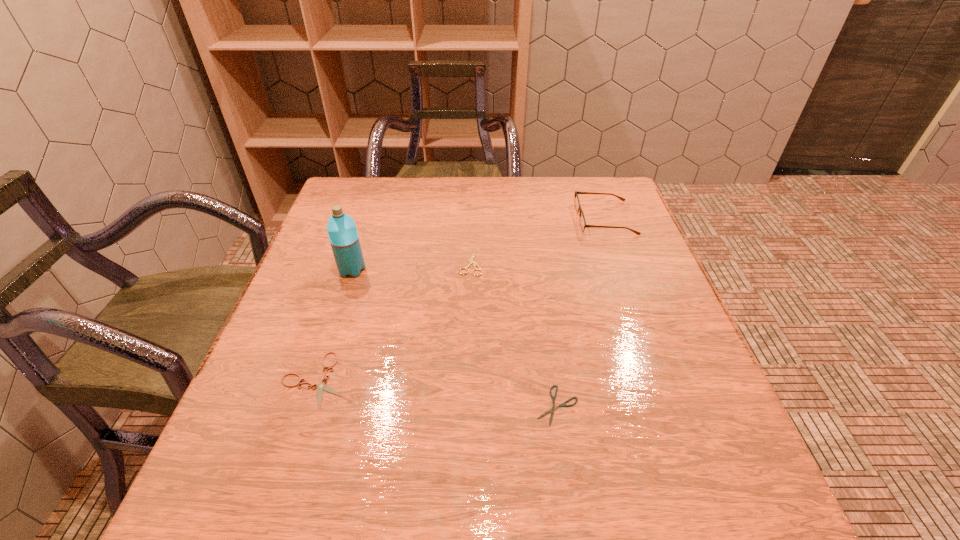
I want to click on empty space that is in between the second shortest object and the spectacles, so click(460, 299).

Identify the location of unoccupied position between the tallest object and the farthest shears. (411, 266).

The image size is (960, 540). I want to click on free space between the tallest object and the second tallest shears, so click(x=333, y=325).

At what (x,y) coordinates should I click in order to perform the action: click on free point between the leftmost shears and the tallest object. Please return your answer as a coordinate pair (x, y). This screenshot has width=960, height=540. Looking at the image, I should click on (333, 325).

Locate an element on the screen. The width and height of the screenshot is (960, 540). blank region between the third tallest object and the second object from right to left is located at coordinates [514, 334].

I want to click on the second closest object to the tallest object, so click(471, 261).

Identify which object is the closest to the second tallest shears. Please provide its 2D coordinates. Your answer should be formatted as a tuple, i.e. [(x, y)], where the tuple contains the x and y coordinates of a point satisfying the conditions above.

[(343, 236)]

Point out which shears is positioned as the nearest to the third object from right to left. Please provide its 2D coordinates. Your answer should be formatted as a tuple, i.e. [(x, y)], where the tuple contains the x and y coordinates of a point satisfying the conditions above.

[(322, 386)]

Identify the location of shears that stands as the second closest to the third object from left to right. (563, 404).

This screenshot has width=960, height=540. Identify the location of vacant space that satisfies the following two spatial constraints: 1. on the back side of the tallest shears; 2. on the right side of the fourth tallest object. (353, 262).